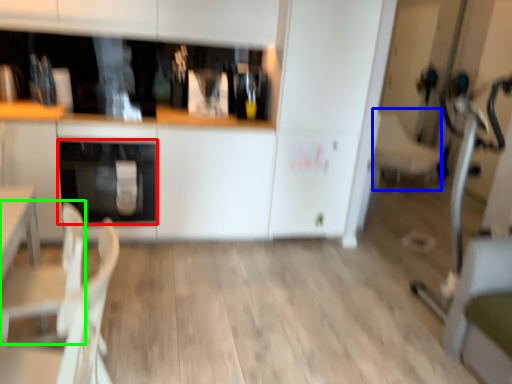
Question: Estimate the real-world distances between objects in this image. Which object is closer to oven (highlighted by a red box), armchair (highlighted by a blue box) or armchair (highlighted by a green box)?

Choices:
 (A) armchair
 (B) armchair

Answer: (B)